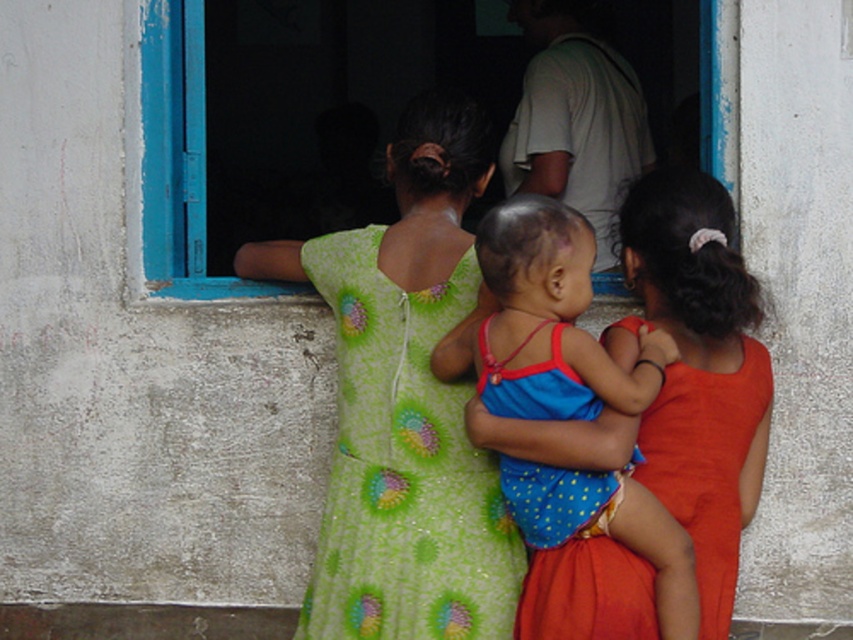
Question: Does blue polka dot fabric at center appear under blue painted wood at upper left?

Choices:
 (A) yes
 (B) no

Answer: (A)

Question: Among these objects, which one is nearest to the camera?

Choices:
 (A) blue polka dot fabric at center
 (B) green printed fabric dress at center
 (C) blue painted wood at upper left

Answer: (A)

Question: Which point appears farthest from the camera in this image?

Choices:
 (A) (595, 582)
 (B) (184, 177)
 (C) (425, 300)
 (D) (548, 520)

Answer: (B)

Question: Does blue polka dot fabric at center have a smaller size compared to orange satin dress at center?

Choices:
 (A) yes
 (B) no

Answer: (A)

Question: Which object is farther from the camera taking this photo?

Choices:
 (A) orange satin dress at center
 (B) blue polka dot fabric at center

Answer: (A)

Question: Is green printed fabric dress at center above blue painted wood at upper left?

Choices:
 (A) yes
 (B) no

Answer: (B)